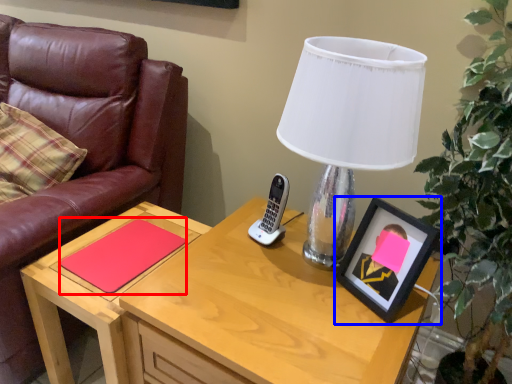
Question: Which object is further to the camera taking this photo, notepad (highlighted by a red box) or picture frame (highlighted by a blue box)?

Choices:
 (A) notepad
 (B) picture frame

Answer: (A)